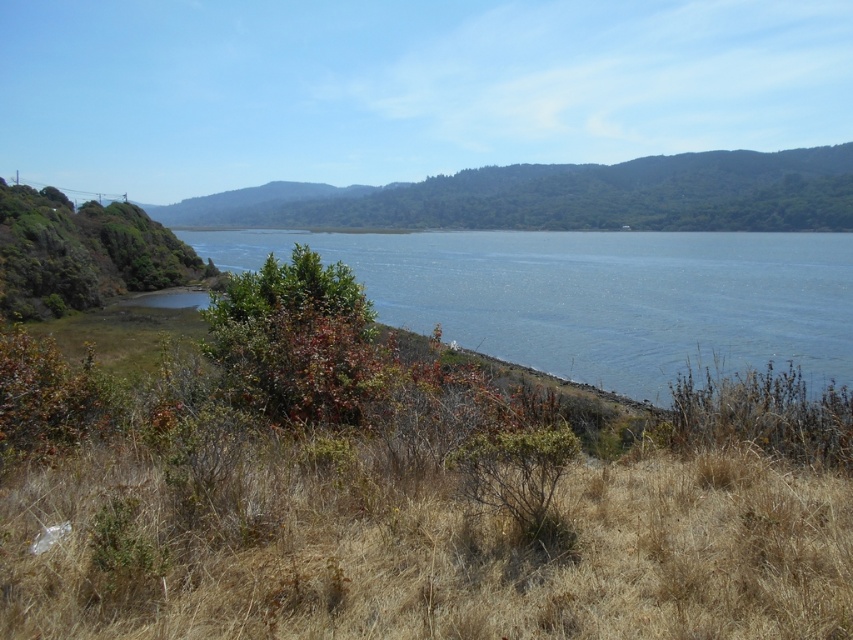
Locate an element on the screen. The width and height of the screenshot is (853, 640). dry grass at lower left is located at coordinates (407, 540).

Between dry grass at lower left and green leafy hillside at center, which one appears on the left side from the viewer's perspective?

green leafy hillside at center is more to the left.

Where is `dry grass at lower left`? The image size is (853, 640). dry grass at lower left is located at coordinates (407, 540).

Does blue water at center appear on the left side of green leafy hillside at center?

No, blue water at center is not to the left of green leafy hillside at center.

The width and height of the screenshot is (853, 640). I want to click on blue water at center, so click(x=598, y=296).

From the picture: Who is shorter, dry grass at lower left or blue water at center?

dry grass at lower left is shorter.

Is dry grass at lower left wider than blue water at center?

In fact, dry grass at lower left might be narrower than blue water at center.

Who is more forward, (515, 600) or (540, 324)?

Point (515, 600) is in front.

The width and height of the screenshot is (853, 640). In order to click on dry grass at lower left in this screenshot , I will do `click(407, 540)`.